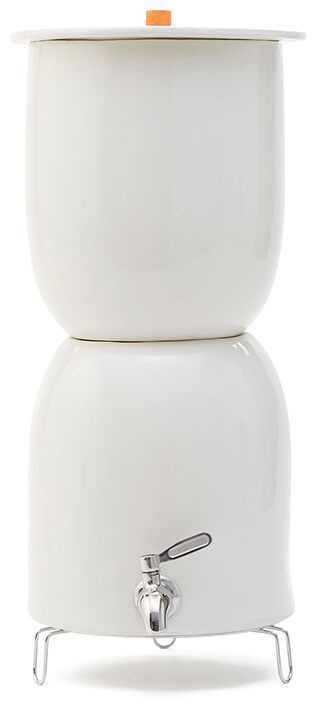
Locate an element on the screen. The height and width of the screenshot is (703, 317). stand is located at coordinates (43, 664), (282, 668).